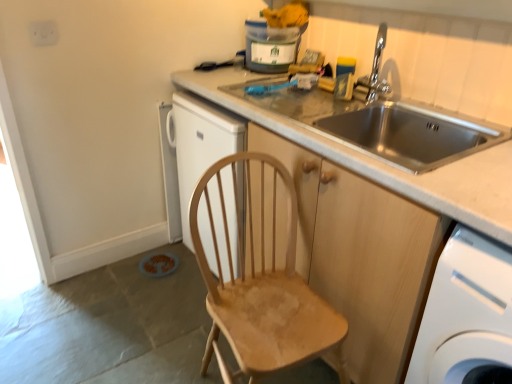
Question: In the image, is chrome metallic faucet at upper right positioned in front of or behind natural wood chair at center?

Choices:
 (A) behind
 (B) front

Answer: (A)

Question: Is chrome metallic faucet at upper right taller or shorter than natural wood chair at center?

Choices:
 (A) tall
 (B) short

Answer: (B)

Question: Which object is the closest to the natural wood chair at center?

Choices:
 (A) white plastic washing machine at lower right
 (B) wooden cabinet at center
 (C) stainless steel sink at upper right
 (D) chrome metallic faucet at upper right

Answer: (B)

Question: Which object is the farthest from the chrome metallic faucet at upper right?

Choices:
 (A) natural wood chair at center
 (B) stainless steel sink at upper right
 (C) wooden cabinet at center
 (D) white plastic washing machine at lower right

Answer: (D)